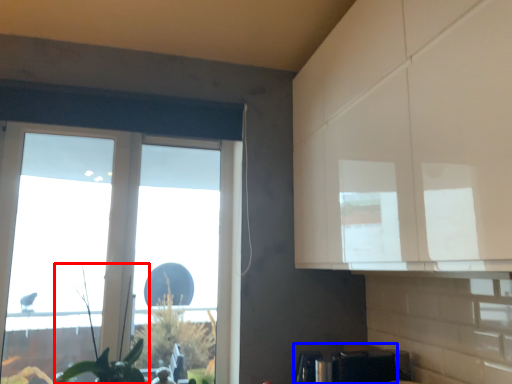
Question: Among these objects, which one is nearest to the camera, plant (highlighted by a red box) or appliance (highlighted by a blue box)?

Choices:
 (A) plant
 (B) appliance

Answer: (B)